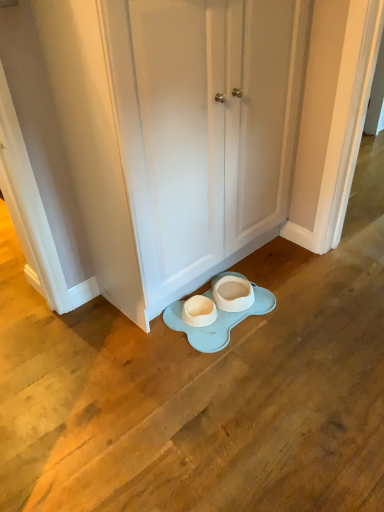
Identify the location of free point below white matte door at center (from a real-world perspective). (253, 268).